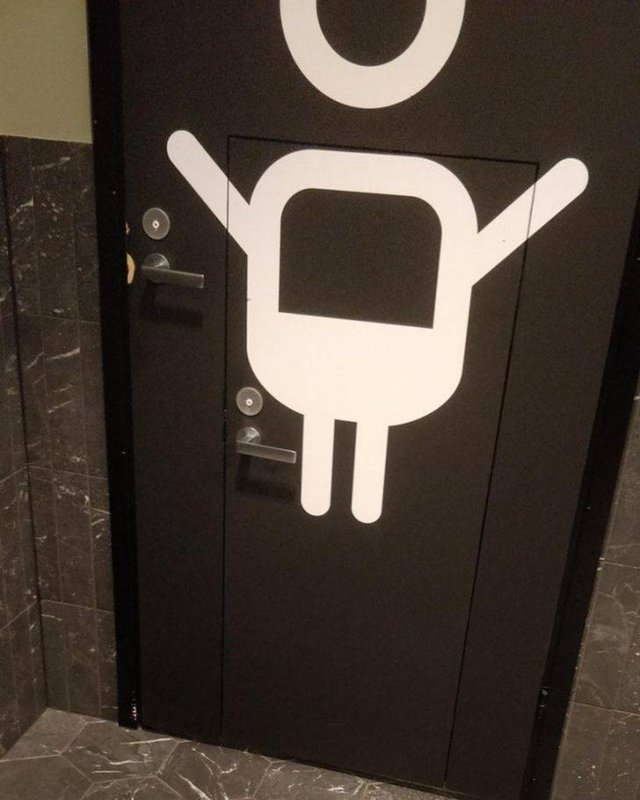
At what (x,y) coordinates should I click in order to perform the action: click on the chest. Please return your answer as a coordinate pair (x, y). This screenshot has height=800, width=640. Looking at the image, I should click on (360, 340).